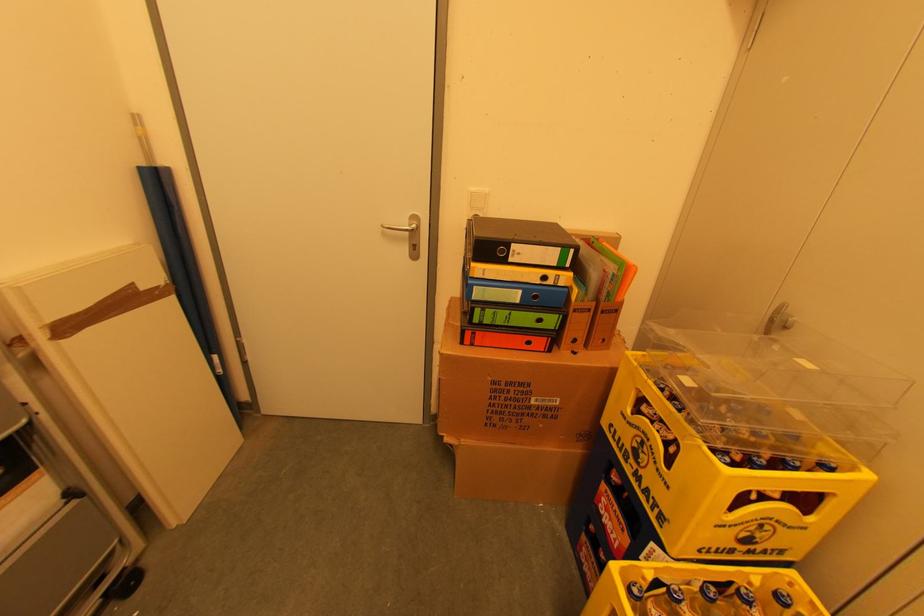
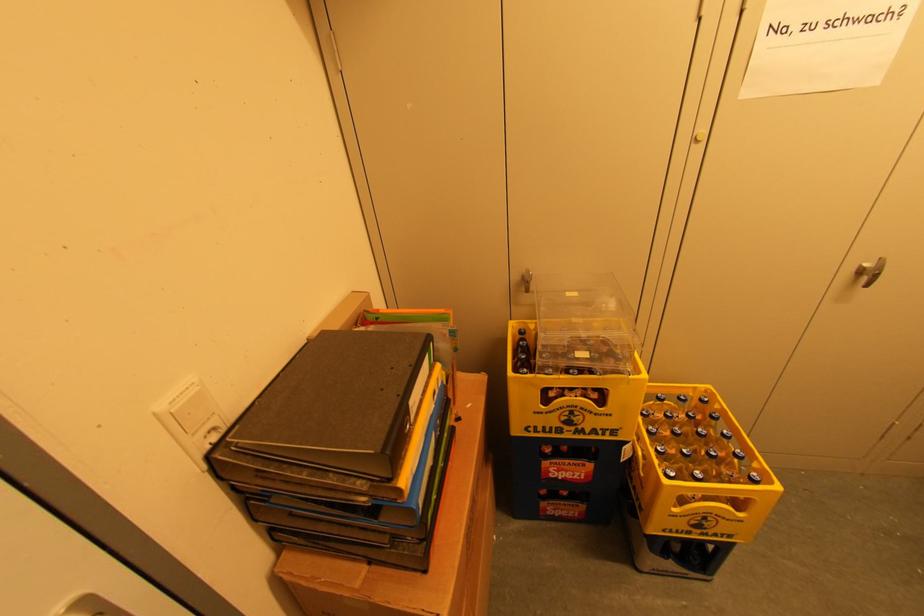
Based on the continuous images, in which direction is the camera rotating?

The camera's rotation is toward right-down.